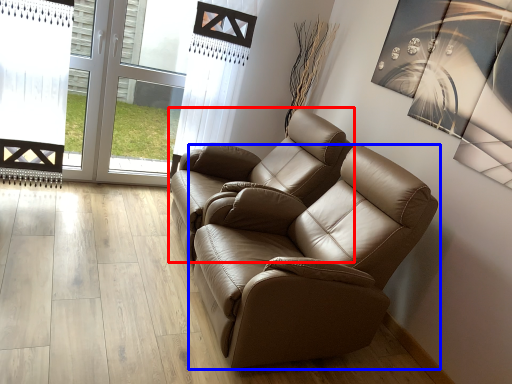
Question: Which of the following is the farthest to the observer, chair (highlighted by a red box) or chair (highlighted by a blue box)?

Choices:
 (A) chair
 (B) chair

Answer: (A)